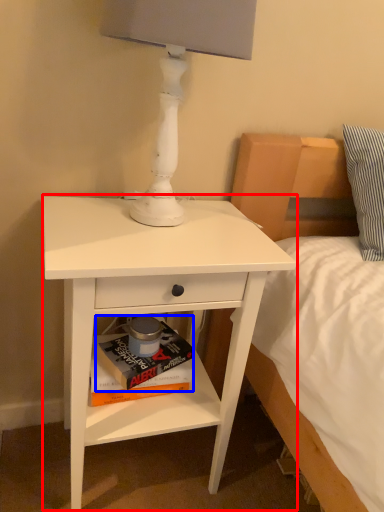
Question: Which point is further to the camera, nightstand (highlighted by a red box) or paperback book (highlighted by a blue box)?

Choices:
 (A) nightstand
 (B) paperback book

Answer: (B)